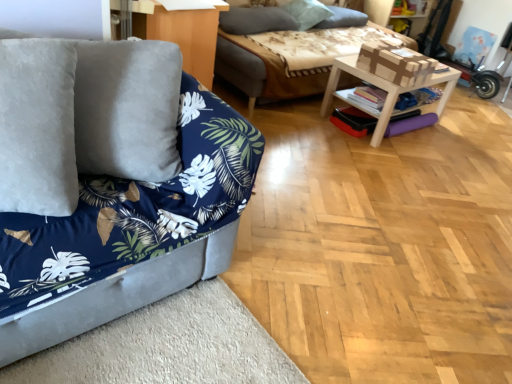
Question: In which direction should I rotate to look at gray soft pillow at upper center, which is counted as the 1th pillow, starting from the left?

Choices:
 (A) left
 (B) right

Answer: (B)

Question: From the image's perspective, is soft gray pillow at upper center, acting as the first pillow starting from the right, above wooden studio couch at upper center, marked as the first studio couch in a back-to-front arrangement?

Choices:
 (A) no
 (B) yes

Answer: (B)

Question: Is soft gray pillow at upper center, which is the third pillow from left to right, placed right next to wooden studio couch at upper center, marked as the first studio couch in a back-to-front arrangement?

Choices:
 (A) yes
 (B) no

Answer: (B)

Question: Considering the relative positions of soft gray pillow at upper center, which is the third pillow from left to right, and wooden studio couch at upper center, the 2th studio couch in the front-to-back sequence, in the image provided, is soft gray pillow at upper center, which is the third pillow from left to right, to the left of wooden studio couch at upper center, the 2th studio couch in the front-to-back sequence, from the viewer's perspective?

Choices:
 (A) no
 (B) yes

Answer: (A)

Question: Could you tell me if soft gray pillow at upper center, which is the third pillow from left to right, is facing wooden studio couch at upper center, the 2th studio couch in the front-to-back sequence?

Choices:
 (A) yes
 (B) no

Answer: (A)

Question: Can you confirm if soft gray pillow at upper center, acting as the first pillow starting from the right, is bigger than wooden studio couch at upper center, which appears as the 2th studio couch when ordered from the bottom?

Choices:
 (A) yes
 (B) no

Answer: (B)

Question: Can you confirm if soft gray pillow at upper center, which is the third pillow from left to right, is shorter than wooden studio couch at upper center, acting as the 1th studio couch starting from the top?

Choices:
 (A) yes
 (B) no

Answer: (A)

Question: From a real-world perspective, is velvet blue couch at left, which appears as the second studio couch when viewed from the back, physically below matte wood dresser at upper center?

Choices:
 (A) no
 (B) yes

Answer: (B)

Question: Can matte wood dresser at upper center be found inside velvet blue couch at left, which ranks as the 1th studio couch in bottom-to-top order?

Choices:
 (A) yes
 (B) no

Answer: (B)

Question: Can you confirm if velvet blue couch at left, which ranks as the 1th studio couch in bottom-to-top order, is shorter than matte wood dresser at upper center?

Choices:
 (A) yes
 (B) no

Answer: (B)

Question: Does velvet blue couch at left, the 2th studio couch positioned from the top, appear on the right side of matte wood dresser at upper center?

Choices:
 (A) yes
 (B) no

Answer: (A)

Question: Does velvet blue couch at left, which appears as the second studio couch when viewed from the back, have a larger size compared to matte wood dresser at upper center?

Choices:
 (A) yes
 (B) no

Answer: (A)

Question: Considering the relative sizes of velvet blue couch at left, the 2th studio couch positioned from the top, and matte wood dresser at upper center in the image provided, is velvet blue couch at left, the 2th studio couch positioned from the top, smaller than matte wood dresser at upper center?

Choices:
 (A) yes
 (B) no

Answer: (B)

Question: Is soft gray pillow at upper center, acting as the first pillow starting from the right, positioned far away from gray soft pillow at upper center, which is the 2th pillow from right to left?

Choices:
 (A) no
 (B) yes

Answer: (A)